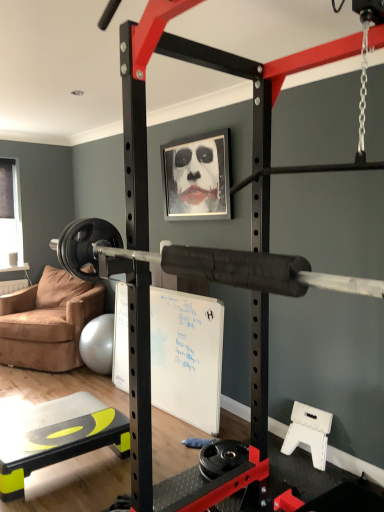
Image resolution: width=384 pixels, height=512 pixels. Identify the location of metallic silver picture frame at upper center. (197, 177).

What do you see at coordinates (57, 437) in the screenshot? I see `yellow-green plastic step at lower left` at bounding box center [57, 437].

Measure the distance between point (0,300) and camera.

The distance of point (0,300) from camera is 4.31 meters.

In order to click on metallic silver picture frame at upper center in this screenshot , I will do `click(197, 177)`.

Could brown suede chair at left be considered to be inside yellow-green plastic step at lower left?

Actually, brown suede chair at left is outside yellow-green plastic step at lower left.

From a real-world perspective, is yellow-green plastic step at lower left physically below brown suede chair at left?

Indeed, from a real-world perspective, yellow-green plastic step at lower left is positioned beneath brown suede chair at left.

Looking at this image, can you confirm if yellow-green plastic step at lower left is bigger than brown suede chair at left?

Actually, yellow-green plastic step at lower left might be smaller than brown suede chair at left.

Where is `chair above the yellow-green plastic step at lower left (from the image's perspective)`? The width and height of the screenshot is (384, 512). chair above the yellow-green plastic step at lower left (from the image's perspective) is located at coordinates click(x=48, y=321).

Is the position of metallic silver picture frame at upper center more distant than that of yellow-green plastic step at lower left?

Yes, metallic silver picture frame at upper center is further from the viewer.

Looking at this image, is metallic silver picture frame at upper center oriented away from yellow-green plastic step at lower left?

metallic silver picture frame at upper center does not have its back to yellow-green plastic step at lower left.

From a real-world perspective, is metallic silver picture frame at upper center positioned under yellow-green plastic step at lower left based on gravity?

Actually, metallic silver picture frame at upper center is physically above yellow-green plastic step at lower left in the real world.

Does metallic silver picture frame at upper center have a lesser width compared to yellow-green plastic step at lower left?

Yes, metallic silver picture frame at upper center is thinner than yellow-green plastic step at lower left.

Is there a large distance between metallic silver picture frame at upper center and transparent plastic window screen at left?

Yes, metallic silver picture frame at upper center is far from transparent plastic window screen at left.

From the image's perspective, which one is positioned higher, metallic silver picture frame at upper center or transparent plastic window screen at left?

metallic silver picture frame at upper center is shown above in the image.

What's the angular difference between metallic silver picture frame at upper center and transparent plastic window screen at left's facing directions?

The angle between the facing direction of metallic silver picture frame at upper center and the facing direction of transparent plastic window screen at left is 90.6 degrees.

Locate an element on the screen. This screenshot has height=512, width=384. window screen behind the metallic silver picture frame at upper center is located at coordinates (10, 212).

How many degrees apart are the facing directions of brown suede chair at left and metallic silver picture frame at upper center?

The angular difference between brown suede chair at left and metallic silver picture frame at upper center is 29 degrees.

Is brown suede chair at left aimed at metallic silver picture frame at upper center?

No, brown suede chair at left is not oriented towards metallic silver picture frame at upper center.

Considering the sizes of objects brown suede chair at left and metallic silver picture frame at upper center in the image provided, who is thinner, brown suede chair at left or metallic silver picture frame at upper center?

Thinner between the two is metallic silver picture frame at upper center.

Can you confirm if brown suede chair at left is shorter than metallic silver picture frame at upper center?

Incorrect, the height of brown suede chair at left does not fall short of that of metallic silver picture frame at upper center.

Does point (36, 301) come in front of point (29, 458)?

No, it is not.

From the image's perspective, which object appears higher, brown suede chair at left or yellow-green plastic step at lower left?

brown suede chair at left appears higher in the image.

Is brown suede chair at left in front of or behind yellow-green plastic step at lower left in the image?

brown suede chair at left is positioned farther from the viewer than yellow-green plastic step at lower left.

The image size is (384, 512). In order to click on picture frame that is above the yellow-green plastic step at lower left (from a real-world perspective) in this screenshot , I will do `click(197, 177)`.

Which is less distant, [80,449] or [229,194]?

Point [80,449].

Can we say yellow-green plastic step at lower left lies outside metallic silver picture frame at upper center?

Yes.

Which is more to the left, yellow-green plastic step at lower left or metallic silver picture frame at upper center?

yellow-green plastic step at lower left.

From the image's perspective, who appears lower, brown suede chair at left or transparent plastic window screen at left?

brown suede chair at left is shown below in the image.

Is brown suede chair at left not within transparent plastic window screen at left?

brown suede chair at left is positioned outside transparent plastic window screen at left.

Is brown suede chair at left placed right next to transparent plastic window screen at left?

brown suede chair at left is not next to transparent plastic window screen at left, and they're not touching.

Consider the image. Can you tell me how much brown suede chair at left and transparent plastic window screen at left differ in facing direction?

They differ by 61.6 degrees in their facing directions.

Find the location of a particular element. Image resolution: width=384 pixels, height=512 pixels. table located below the brown suede chair at left (from the image's perspective) is located at coordinates (57, 437).

In order to click on table to the left of metallic silver picture frame at upper center in this screenshot , I will do `click(57, 437)`.

Based on their spatial positions, is yellow-green plastic step at lower left or metallic silver picture frame at upper center closer to transparent plastic window screen at left?

metallic silver picture frame at upper center.

Based on the photo, from the image, which object appears to be nearer to yellow-green plastic step at lower left, transparent plastic window screen at left or metallic silver picture frame at upper center?

metallic silver picture frame at upper center is closer to yellow-green plastic step at lower left.

From the image, which object appears to be nearer to brown suede chair at left, metallic silver picture frame at upper center or transparent plastic window screen at left?

Based on the image, transparent plastic window screen at left appears to be nearer to brown suede chair at left.

Estimate the real-world distances between objects in this image. Which object is closer to metallic silver picture frame at upper center, yellow-green plastic step at lower left or brown suede chair at left?

brown suede chair at left lies closer to metallic silver picture frame at upper center than the other object.

Looking at the image, which one is located further to transparent plastic window screen at left, brown suede chair at left or metallic silver picture frame at upper center?

metallic silver picture frame at upper center is further to transparent plastic window screen at left.

Based on the photo, which object lies nearer to the anchor point transparent plastic window screen at left, yellow-green plastic step at lower left or brown suede chair at left?

brown suede chair at left is positioned closer to the anchor transparent plastic window screen at left.

Looking at the image, which one is located closer to metallic silver picture frame at upper center, transparent plastic window screen at left or yellow-green plastic step at lower left?

yellow-green plastic step at lower left is closer to metallic silver picture frame at upper center.

Considering their positions, is transparent plastic window screen at left positioned closer to yellow-green plastic step at lower left than brown suede chair at left?

Based on the image, brown suede chair at left appears to be nearer to yellow-green plastic step at lower left.

At what (x,y) coordinates should I click in order to perform the action: click on chair located between yellow-green plastic step at lower left and transparent plastic window screen at left in the depth direction. Please return your answer as a coordinate pair (x, y). Image resolution: width=384 pixels, height=512 pixels. Looking at the image, I should click on (48, 321).

At what (x,y) coordinates should I click in order to perform the action: click on picture frame between yellow-green plastic step at lower left and transparent plastic window screen at left along the z-axis. Please return your answer as a coordinate pair (x, y). Image resolution: width=384 pixels, height=512 pixels. Looking at the image, I should click on (197, 177).

The image size is (384, 512). Identify the location of chair located between transparent plastic window screen at left and metallic silver picture frame at upper center in the left-right direction. (48, 321).

I want to click on chair between metallic silver picture frame at upper center and yellow-green plastic step at lower left vertically, so click(x=48, y=321).